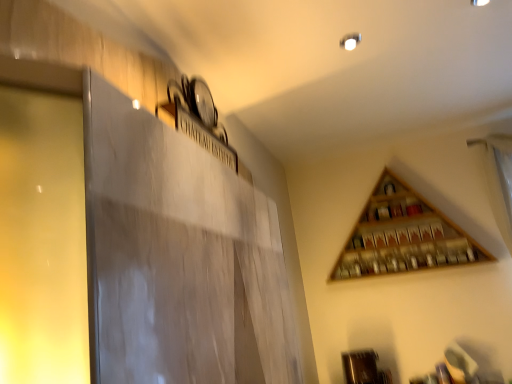
This screenshot has width=512, height=384. What do you see at coordinates (403, 235) in the screenshot?
I see `wooden triangle at upper right` at bounding box center [403, 235].

Identify the location of wooden triangle at upper right. (403, 235).

Find the location of `wooden triangle at upper right`. wooden triangle at upper right is located at coordinates pos(403,235).